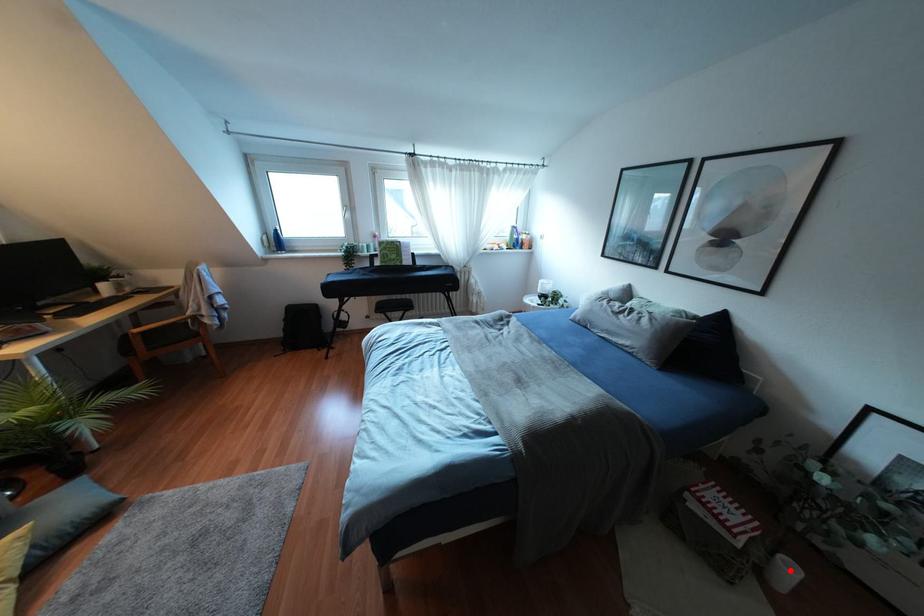
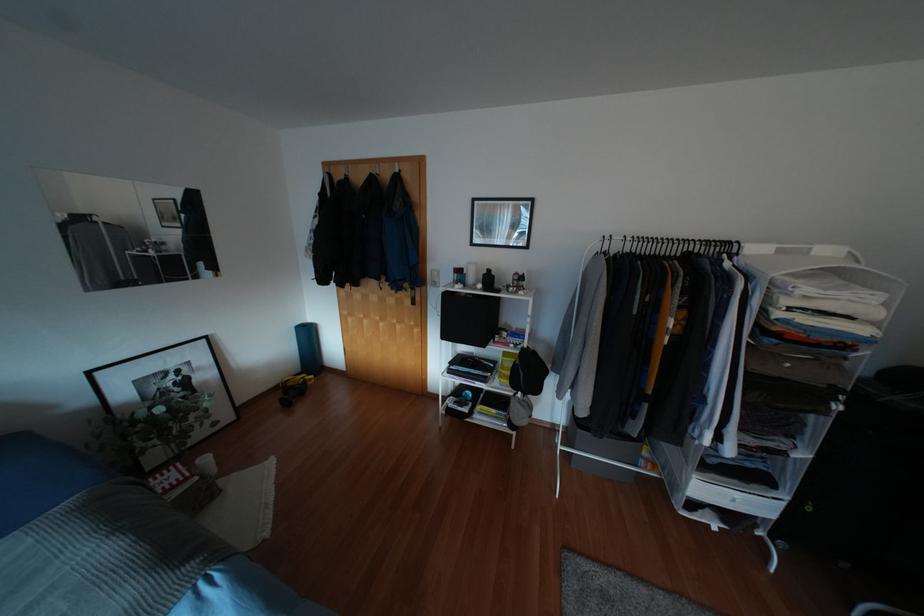
Question: I am providing you with two images of the same scene from different viewpoints. A red point is marked on the first image. Is the red point's position out of view in image 2?

Choices:
 (A) Yes
 (B) No

Answer: (B)